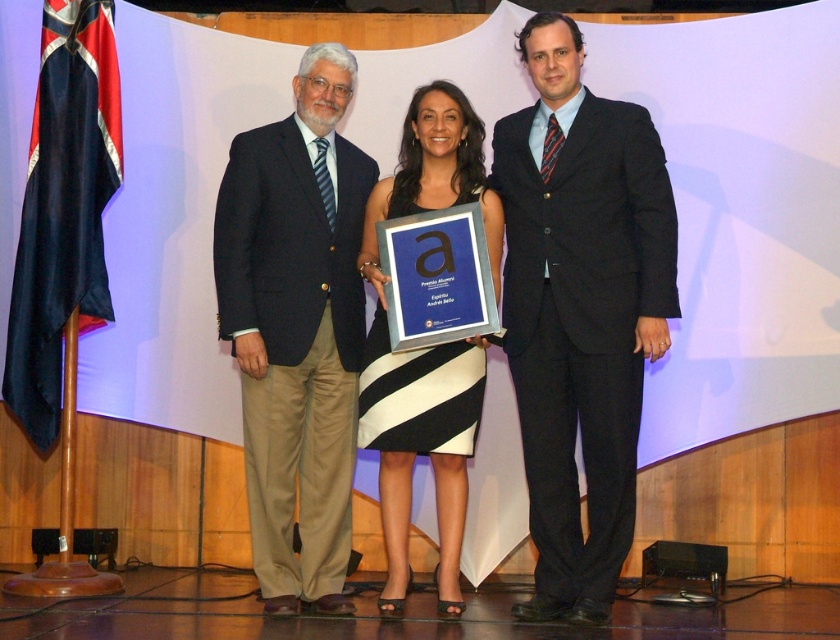
Does black and white striped dress at center appear under black silk flag at left?

Yes, black and white striped dress at center is below black silk flag at left.

Is black and white striped dress at center closer to camera compared to black silk flag at left?

That is True.

Is point (420, 124) positioned before point (32, 184)?

Yes, it is.

In order to click on black and white striped dress at center in this screenshot , I will do `click(424, 348)`.

Is black suit at center to the left of dark blue suit at left from the viewer's perspective?

In fact, black suit at center is to the right of dark blue suit at left.

Which is in front, point (584, 234) or point (318, 424)?

Point (584, 234)

Does point (565, 342) lie in front of point (295, 170)?

Yes, point (565, 342) is closer to viewer.

Image resolution: width=840 pixels, height=640 pixels. Find the location of `black suit at center`. black suit at center is located at coordinates (580, 310).

Between black suit at center and black silk flag at left, which one appears on the left side from the viewer's perspective?

black silk flag at left is more to the left.

Which is below, black suit at center or black silk flag at left?

black suit at center is below.

Locate an element on the screen. The image size is (840, 640). black suit at center is located at coordinates (580, 310).

This screenshot has width=840, height=640. What are the coordinates of `black suit at center` in the screenshot? It's located at (580, 310).